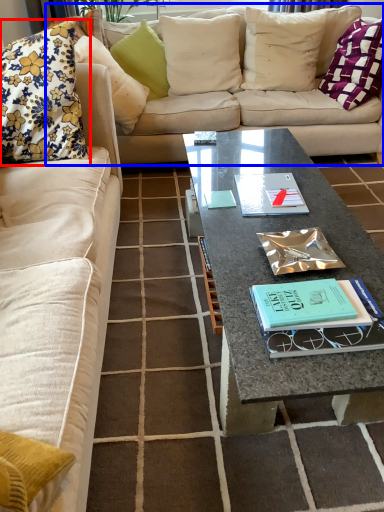
Question: Among these objects, which one is farthest to the camera, pillow (highlighted by a red box) or studio couch (highlighted by a blue box)?

Choices:
 (A) pillow
 (B) studio couch

Answer: (B)